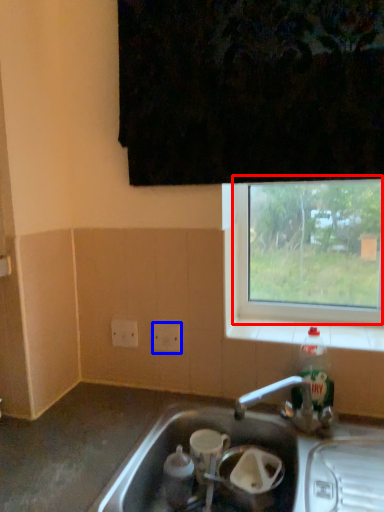
Question: Which object is further to the camera taking this photo, window (highlighted by a red box) or electric outlet (highlighted by a blue box)?

Choices:
 (A) window
 (B) electric outlet

Answer: (B)